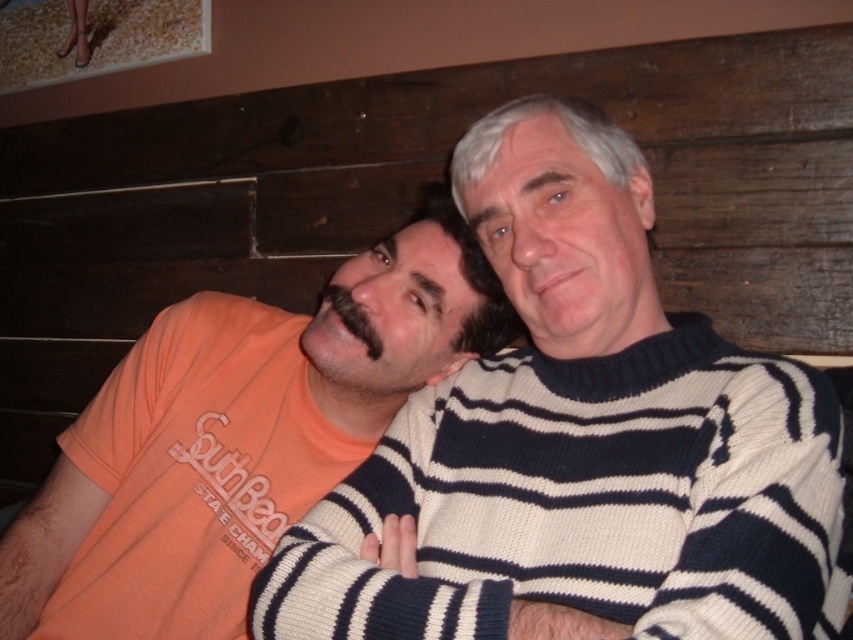
Question: Is the position of orange cotton t-shirt at left less distant than that of black fuzzy beard at center?

Choices:
 (A) yes
 (B) no

Answer: (A)

Question: Is knitted striped sweater at center thinner than black fuzzy beard at center?

Choices:
 (A) yes
 (B) no

Answer: (B)

Question: Which point appears closest to the camera in this image?

Choices:
 (A) (824, 449)
 (B) (345, 323)

Answer: (A)

Question: Which point is closer to the camera taking this photo?

Choices:
 (A) (325, 285)
 (B) (233, 474)

Answer: (B)

Question: Estimate the real-world distances between objects in this image. Which object is farther from the black fuzzy beard at center?

Choices:
 (A) knitted striped sweater at center
 (B) orange cotton t-shirt at left

Answer: (A)

Question: Does orange cotton t-shirt at left appear over black fuzzy beard at center?

Choices:
 (A) yes
 (B) no

Answer: (B)